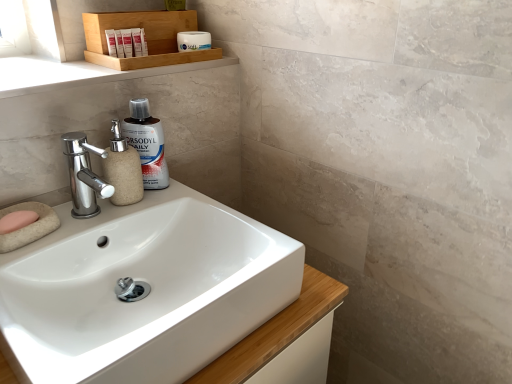
The image size is (512, 384). In order to click on beige marble tray at upper left in this screenshot , I will do coord(78,73).

This screenshot has width=512, height=384. What are the coordinates of `matte white tube at upper left, acting as the 1th toiletry starting from the front` in the screenshot? It's located at (111, 42).

Locate an element on the screen. Image resolution: width=512 pixels, height=384 pixels. pink sponge at lower left is located at coordinates (17, 221).

What do you see at coordinates (17, 221) in the screenshot? The height and width of the screenshot is (384, 512). I see `pink sponge at lower left` at bounding box center [17, 221].

How much space does white matte jar at upper center, marked as the third toiletry in a front-to-back arrangement, occupy horizontally?

white matte jar at upper center, marked as the third toiletry in a front-to-back arrangement, is 3.18 inches wide.

What is the approximate height of beige textured soap dispenser at left?

It is 6.73 inches.

This screenshot has width=512, height=384. In order to click on white glossy sink at center in this screenshot , I will do `click(148, 295)`.

The height and width of the screenshot is (384, 512). Identify the location of white matte tube at upper center, the second toiletry in the left-to-right sequence. (119, 44).

This screenshot has height=384, width=512. I want to click on beige marble tray at upper left, so click(78, 73).

How different are the orientations of chrome/metallic faucet at left and white matte tube at upper center, placed as the second toiletry when sorted from right to left, in degrees?

The angle between the facing direction of chrome/metallic faucet at left and the facing direction of white matte tube at upper center, placed as the second toiletry when sorted from right to left, is 26.4 degrees.

You are a GUI agent. You are given a task and a screenshot of the screen. Output one action in this format:
    pyautogui.click(x=<x>, y=<y>)
    Task: Click on the tap below the white matte tube at upper center, the second toiletry when ordered from back to front (from a real-world perspective)
    This screenshot has height=384, width=512.
    Given the screenshot: What is the action you would take?
    pyautogui.click(x=84, y=175)

Is chrome/metallic faucet at left taller or shorter than white matte tube at upper center, the second toiletry in the left-to-right sequence?

chrome/metallic faucet at left is taller than white matte tube at upper center, the second toiletry in the left-to-right sequence.

Based on their sizes in the image, would you say chrome/metallic faucet at left is bigger or smaller than white matte tube at upper center, placed as the second toiletry when sorted from right to left?

Clearly, chrome/metallic faucet at left is larger in size than white matte tube at upper center, placed as the second toiletry when sorted from right to left.

Image resolution: width=512 pixels, height=384 pixels. What are the coordinates of `the 3rd toiletry above the white glossy sink at center (from the image's perspective)` in the screenshot? It's located at (193, 41).

Is point (189, 31) in front of point (181, 262)?

No, it is not.

Looking at their sizes, would you say white matte jar at upper center, which is the first toiletry in right-to-left order, is wider or thinner than white glossy sink at center?

Clearly, white matte jar at upper center, which is the first toiletry in right-to-left order, has less width compared to white glossy sink at center.

Can you tell me how much white matte jar at upper center, the 1th toiletry when ordered from back to front, and white glossy sink at center differ in facing direction?

The facing directions of white matte jar at upper center, the 1th toiletry when ordered from back to front, and white glossy sink at center are 3.15 degrees apart.

Identify the location of cleaning product behind the beige textured soap dispenser at left. (147, 143).

Looking at this image, which is closer, (143,168) or (117,204)?

The point (117,204) is closer.

Can you confirm if translucent plastic bottle at center is thinner than beige textured soap dispenser at left?

Correct, the width of translucent plastic bottle at center is less than that of beige textured soap dispenser at left.

Is translucent plastic bottle at center to the left of beige textured soap dispenser at left from the viewer's perspective?

No, translucent plastic bottle at center is not to the left of beige textured soap dispenser at left.

Considering the relative sizes of white matte jar at upper center, which is the first toiletry in right-to-left order, and beige textured soap dispenser at left in the image provided, is white matte jar at upper center, which is the first toiletry in right-to-left order, bigger than beige textured soap dispenser at left?

Incorrect, white matte jar at upper center, which is the first toiletry in right-to-left order, is not larger than beige textured soap dispenser at left.

Does point (197, 50) lie in front of point (126, 143)?

That is False.

This screenshot has width=512, height=384. There is a beige textured soap dispenser at left. What are the coordinates of `the 3rd toiletry above it (from the image's perspective)` in the screenshot? It's located at (193, 41).

From a real-world perspective, is white matte jar at upper center, the 1th toiletry when ordered from back to front, located higher than beige textured soap dispenser at left?

Correct, in the physical world, white matte jar at upper center, the 1th toiletry when ordered from back to front, is higher than beige textured soap dispenser at left.

Is beige textured soap dispenser at left wider or thinner than white matte tube at upper center, the second toiletry when ordered from back to front?

In the image, beige textured soap dispenser at left appears to be wider than white matte tube at upper center, the second toiletry when ordered from back to front.

In the scene shown: How many degrees apart are the facing directions of beige textured soap dispenser at left and white matte tube at upper center, the second toiletry when ordered from back to front?

The angular difference between beige textured soap dispenser at left and white matte tube at upper center, the second toiletry when ordered from back to front, is 26.4 degrees.

Would you consider beige textured soap dispenser at left to be distant from white matte tube at upper center, placed as the second toiletry when sorted from front to back?

They are positioned close to each other.

Is beige textured soap dispenser at left aimed at white matte tube at upper center, the second toiletry in the left-to-right sequence?

No, beige textured soap dispenser at left is not turned towards white matte tube at upper center, the second toiletry in the left-to-right sequence.

Considering the relative sizes of chrome/metallic faucet at left and white matte jar at upper center, positioned as the third toiletry in left-to-right order, in the image provided, is chrome/metallic faucet at left shorter than white matte jar at upper center, positioned as the third toiletry in left-to-right order,?

No.

Measure the distance between chrome/metallic faucet at left and white matte jar at upper center, which is the first toiletry in right-to-left order.

chrome/metallic faucet at left and white matte jar at upper center, which is the first toiletry in right-to-left order, are 15.93 inches apart from each other.

Can you confirm if chrome/metallic faucet at left is bigger than white matte jar at upper center, which is the first toiletry in right-to-left order?

Yes.

Is chrome/metallic faucet at left to the right of white matte jar at upper center, marked as the third toiletry in a front-to-back arrangement, from the viewer's perspective?

In fact, chrome/metallic faucet at left is to the left of white matte jar at upper center, marked as the third toiletry in a front-to-back arrangement.

Is matte white tube at upper left, which is the first toiletry from left to right, beside translucent plastic bottle at center?

matte white tube at upper left, which is the first toiletry from left to right, is not next to translucent plastic bottle at center, and they're not touching.

Where is `toiletry that is the 1st one when counting backward from the translucent plastic bottle at center`? The width and height of the screenshot is (512, 384). toiletry that is the 1st one when counting backward from the translucent plastic bottle at center is located at coordinates (111, 42).

Between matte white tube at upper left, which is the first toiletry from left to right, and translucent plastic bottle at center, which one has larger size?

translucent plastic bottle at center is bigger.

Who is taller, matte white tube at upper left, which is the first toiletry from left to right, or translucent plastic bottle at center?

Standing taller between the two is translucent plastic bottle at center.

This screenshot has height=384, width=512. Identify the location of the 3rd toiletry positioned above the chrome/metallic faucet at left (from a real-world perspective). (119, 44).

The image size is (512, 384). I want to click on sink on the left of white matte jar at upper center, marked as the third toiletry in a front-to-back arrangement, so click(x=148, y=295).

Considering their positions, is white matte tube at upper center, placed as the second toiletry when sorted from front to back, positioned further to wooden tray at upper center than pink sponge at lower left?

The object further to wooden tray at upper center is pink sponge at lower left.

Based on their spatial positions, is wooden tray at upper center or white matte jar at upper center, marked as the third toiletry in a front-to-back arrangement, further from chrome/metallic faucet at left?

white matte jar at upper center, marked as the third toiletry in a front-to-back arrangement, is further to chrome/metallic faucet at left.

From the picture: From the image, which object appears to be nearer to wooden tray at upper center, beige marble tray at upper left or beige textured soap dispenser at left?

Among the two, beige marble tray at upper left is located nearer to wooden tray at upper center.

Estimate the real-world distances between objects in this image. Which object is further from matte white tube at upper left, which is counted as the 3th toiletry, starting from the right, white matte tube at upper center, placed as the second toiletry when sorted from right to left, or wooden tray at upper center?

Based on the image, wooden tray at upper center appears to be further to matte white tube at upper left, which is counted as the 3th toiletry, starting from the right.

Considering their positions, is white matte jar at upper center, marked as the third toiletry in a front-to-back arrangement, positioned further to white glossy sink at center than pink sponge at lower left?

white matte jar at upper center, marked as the third toiletry in a front-to-back arrangement, is further to white glossy sink at center.

Looking at the image, which one is located closer to beige marble tray at upper left, white glossy sink at center or chrome/metallic faucet at left?

chrome/metallic faucet at left is positioned closer to the anchor beige marble tray at upper left.

Which object lies further to the anchor point matte white tube at upper left, which is the first toiletry from left to right, beige marble tray at upper left or translucent plastic bottle at center?

Based on the image, translucent plastic bottle at center appears to be further to matte white tube at upper left, which is the first toiletry from left to right.

When comparing their distances from white glossy sink at center, does white matte tube at upper center, the second toiletry when ordered from back to front, or pink sponge at lower left seem closer?

Based on the image, pink sponge at lower left appears to be nearer to white glossy sink at center.

Locate an element on the screen. Image resolution: width=512 pixels, height=384 pixels. tap between beige marble tray at upper left and white glossy sink at center in the up-down direction is located at coordinates (84, 175).

What are the coordinates of `tap between matte white tube at upper left, marked as the third toiletry in a back-to-front arrangement, and pink sponge at lower left, in the vertical direction` in the screenshot? It's located at (84, 175).

This screenshot has height=384, width=512. What are the coordinates of `soap dispenser between white glossy sink at center and wooden tray at upper center from front to back` in the screenshot? It's located at (123, 169).

This screenshot has width=512, height=384. Identify the location of cleaning product between white matte tube at upper center, the second toiletry when ordered from back to front, and beige textured soap dispenser at left in the up-down direction. (147, 143).